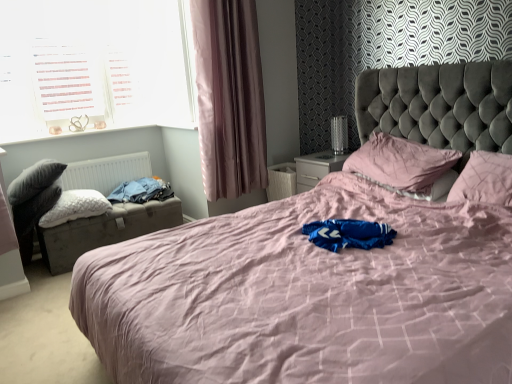
What are the coordinates of `free area in between blue fabric at left and white fluffy pillow at left, which appears as the 1th pillow when viewed from the left` in the screenshot? It's located at (135, 207).